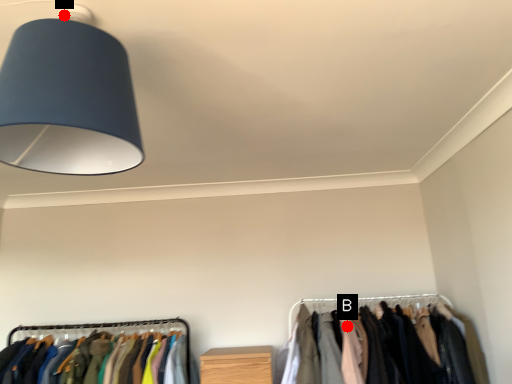
Question: Two points are circled on the image, labeled by A and B beside each circle. Which point appears closest to the camera in this image?

Choices:
 (A) A is closer
 (B) B is closer

Answer: (A)